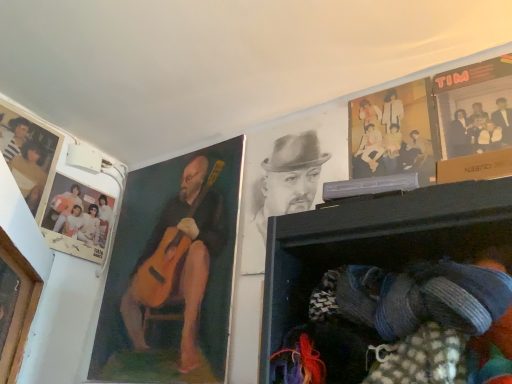
Question: From the image's perspective, is knitted fabric at lower right below wooden frame at left?

Choices:
 (A) no
 (B) yes

Answer: (A)

Question: Is knitted fabric at lower right wider than wooden frame at left?

Choices:
 (A) yes
 (B) no

Answer: (A)

Question: Is wooden frame at left a part of knitted fabric at lower right?

Choices:
 (A) no
 (B) yes

Answer: (A)

Question: Is knitted fabric at lower right facing towards wooden frame at left?

Choices:
 (A) yes
 (B) no

Answer: (B)

Question: Does knitted fabric at lower right have a smaller size compared to wooden frame at left?

Choices:
 (A) no
 (B) yes

Answer: (A)

Question: Is knitted fabric at lower right with wooden frame at left?

Choices:
 (A) no
 (B) yes

Answer: (A)

Question: Is the surface of matte plastic picture frame at upper left in direct contact with matte paper poster at upper right, the second poster page positioned from the back?

Choices:
 (A) yes
 (B) no

Answer: (B)

Question: From the image's perspective, is matte plastic picture frame at upper left over matte paper poster at upper right, the first poster page in the front-to-back sequence?

Choices:
 (A) no
 (B) yes

Answer: (A)

Question: Considering the relative positions of matte plastic picture frame at upper left and matte paper poster at upper right, arranged as the second poster page when viewed from the left, in the image provided, is matte plastic picture frame at upper left to the left of matte paper poster at upper right, arranged as the second poster page when viewed from the left, from the viewer's perspective?

Choices:
 (A) yes
 (B) no

Answer: (A)

Question: Is matte plastic picture frame at upper left bigger than matte paper poster at upper right, arranged as the second poster page when viewed from the left?

Choices:
 (A) no
 (B) yes

Answer: (B)

Question: Considering the relative sizes of matte plastic picture frame at upper left and matte paper poster at upper right, the first poster page in the front-to-back sequence, in the image provided, is matte plastic picture frame at upper left wider than matte paper poster at upper right, the first poster page in the front-to-back sequence,?

Choices:
 (A) yes
 (B) no

Answer: (A)

Question: Does matte plastic picture frame at upper left have a lesser height compared to matte paper poster at upper right, the 1th poster page in the right-to-left sequence?

Choices:
 (A) yes
 (B) no

Answer: (A)

Question: Can you confirm if wooden guitar at left, which appears as the first man when viewed from the left, is positioned to the left of matte paper photo at upper left, which is the second poster page in right-to-left order?

Choices:
 (A) no
 (B) yes

Answer: (A)